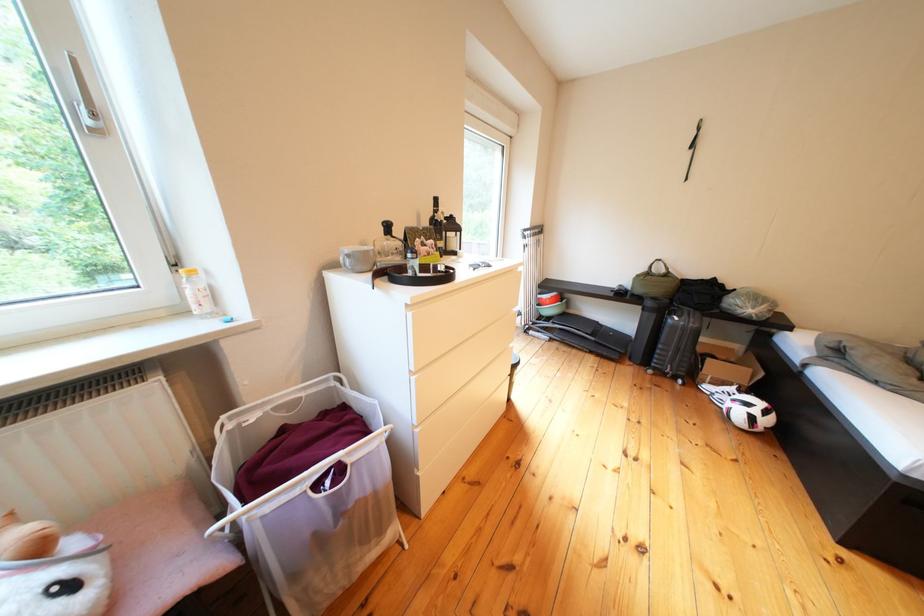
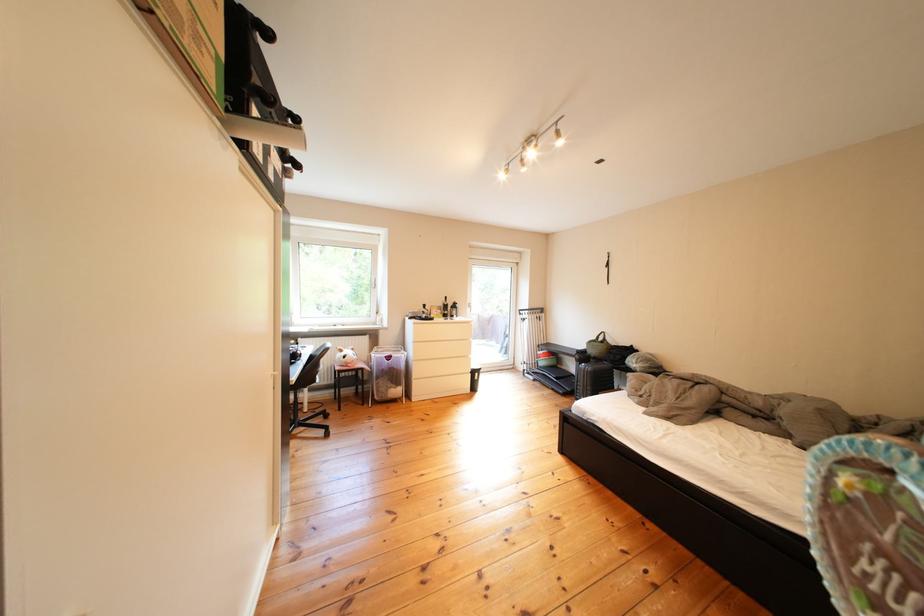
In the second image, find the point that corresponds to (586,315) in the first image.

(578, 371)